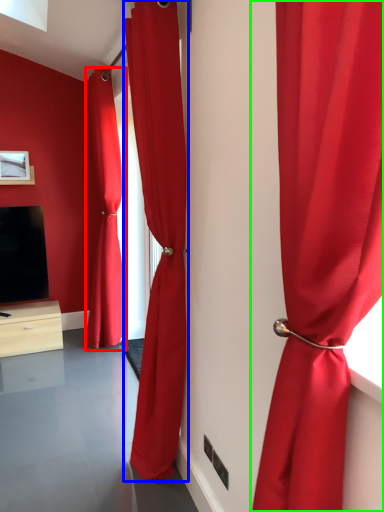
Question: Based on their relative distances, which object is nearer to curtain (highlighted by a red box)? Choose from curtain (highlighted by a blue box) and curtain (highlighted by a green box).

Choices:
 (A) curtain
 (B) curtain

Answer: (A)